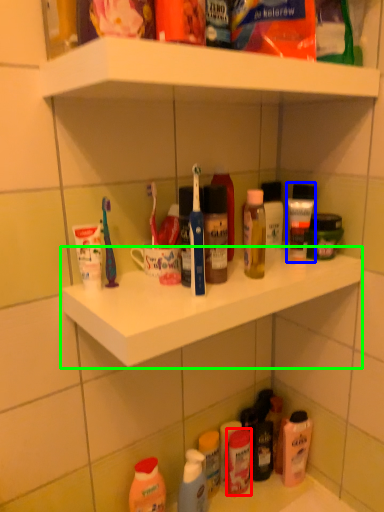
Question: Which object is the closest to the toiletry (highlighted by a red box)? Choose among these: toiletry (highlighted by a blue box) or ledge (highlighted by a green box).

Choices:
 (A) toiletry
 (B) ledge

Answer: (B)